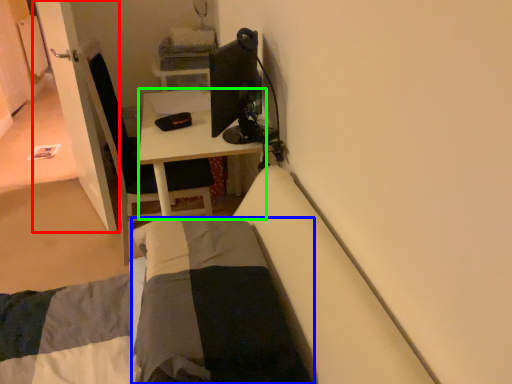
Question: Based on their relative distances, which object is nearer to door (highlighted by a red box)? Choose from blanket (highlighted by a blue box) and desk (highlighted by a green box).

Choices:
 (A) blanket
 (B) desk

Answer: (B)